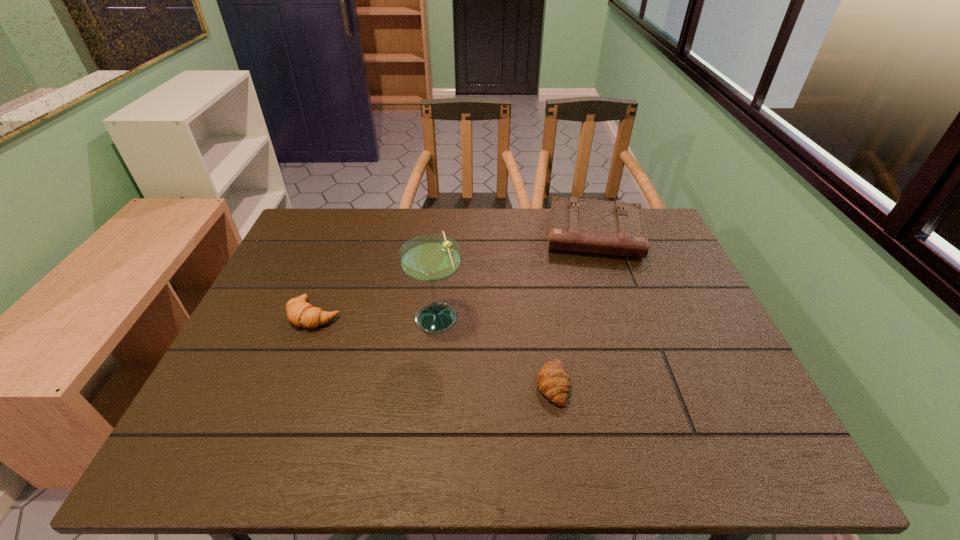
You are a GUI agent. You are given a task and a screenshot of the screen. Output one action in this format:
    pyautogui.click(x=<x>, y=<y>)
    Task: Click on the second object from left to right
    
    Given the screenshot: What is the action you would take?
    pyautogui.click(x=430, y=258)

Locate an element on the screen. The width and height of the screenshot is (960, 540). the tallest object is located at coordinates (430, 258).

You are a GUI agent. You are given a task and a screenshot of the screen. Output one action in this format:
    pyautogui.click(x=<x>, y=<y>)
    Task: Click on the hardback book
    
    Given the screenshot: What is the action you would take?
    pyautogui.click(x=616, y=228)

At what (x,y) coordinates should I click in order to perform the action: click on the second tallest object. Please return your answer as a coordinate pair (x, y). The height and width of the screenshot is (540, 960). Looking at the image, I should click on (616, 228).

At what (x,y) coordinates should I click in order to perform the action: click on the left crescent roll. Please return your answer as a coordinate pair (x, y). The image size is (960, 540). Looking at the image, I should click on (302, 314).

At what (x,y) coordinates should I click in order to perform the action: click on the leftmost object. Please return your answer as a coordinate pair (x, y). Looking at the image, I should click on (302, 314).

In order to click on the nearer crescent roll in this screenshot , I will do `click(553, 381)`.

This screenshot has width=960, height=540. In order to click on the nearest object in this screenshot , I will do `click(553, 381)`.

This screenshot has width=960, height=540. Identify the location of vacant space located 0.190m on the left of the martini. (335, 317).

Locate an element on the screen. vacant point located on the front of the rightmost object is located at coordinates (624, 322).